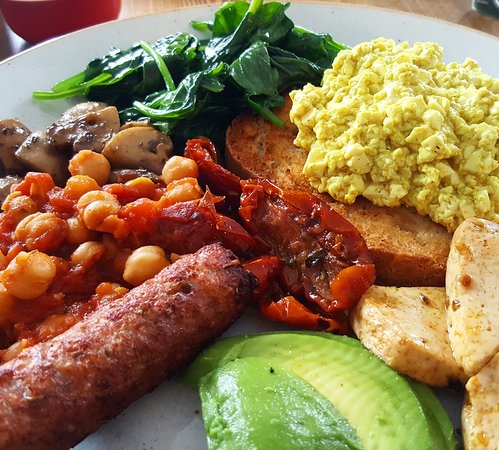
Locate an element on the screen. table is located at coordinates (443, 7).